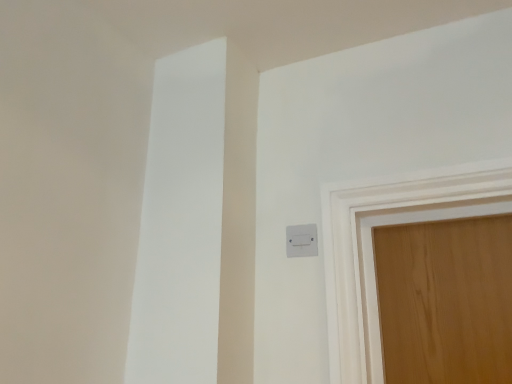
The height and width of the screenshot is (384, 512). In order to click on white plastic light switch at upper right in this screenshot , I will do `click(301, 240)`.

Describe the element at coordinates (301, 240) in the screenshot. I see `white plastic light switch at upper right` at that location.

Identify the location of white plastic light switch at upper right. The height and width of the screenshot is (384, 512). (301, 240).